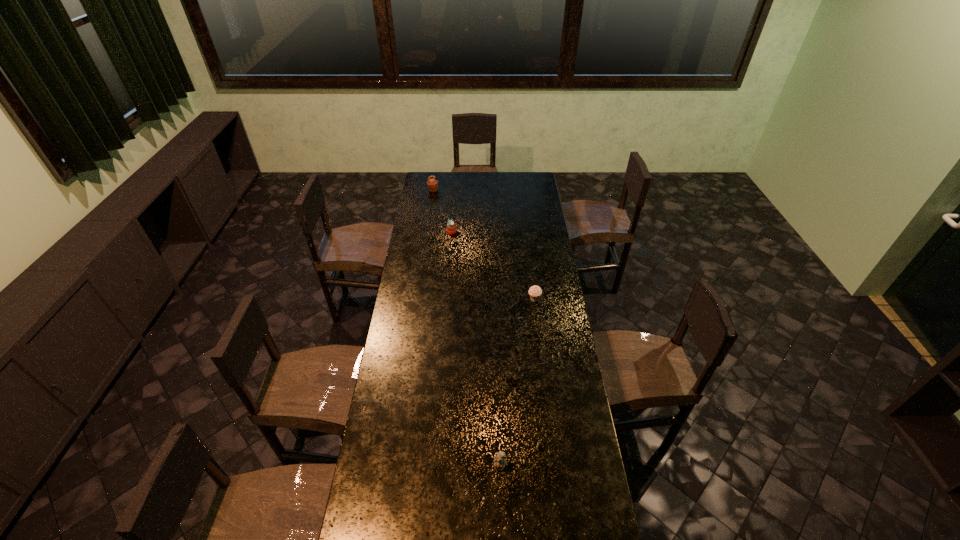
Find the location of `the farthest muffin`. the farthest muffin is located at coordinates (432, 184).

You are a GUI agent. You are given a task and a screenshot of the screen. Output one action in this format:
    pyautogui.click(x=<x>, y=<y>)
    Task: Click on the leftmost object
    The height and width of the screenshot is (540, 960).
    Given the screenshot: What is the action you would take?
    pyautogui.click(x=432, y=184)

Find the location of a particular element. the third object from right to left is located at coordinates click(451, 229).

Image resolution: width=960 pixels, height=540 pixels. I want to click on the second muffin from right to left, so click(451, 229).

Where is `the rightmost muffin`? The image size is (960, 540). the rightmost muffin is located at coordinates (535, 292).

Where is `the rightmost object`? This screenshot has height=540, width=960. the rightmost object is located at coordinates [x=535, y=292].

Locate an element on the screen. the nearest object is located at coordinates (499, 462).

The height and width of the screenshot is (540, 960). Identify the location of the second object from right to left. (499, 462).

Identify the location of free space located on the front of the farthest object. Image resolution: width=960 pixels, height=540 pixels. (428, 224).

At what (x,y) coordinates should I click in order to perform the action: click on free spot located 0.050m on the front-facing side of the second muffin from right to left. Please return your answer as a coordinate pair (x, y). Image resolution: width=960 pixels, height=540 pixels. Looking at the image, I should click on (466, 232).